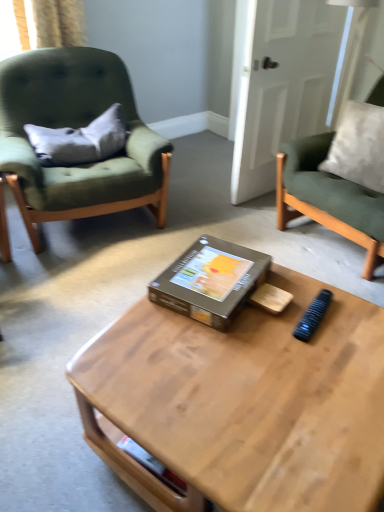
Question: Is gray fabric pillow at left smaller than green fabric chair at left, the second chair from the right?

Choices:
 (A) yes
 (B) no

Answer: (A)

Question: Would you say gray fabric pillow at left contains green fabric chair at left, arranged as the 1th chair when viewed from the left?

Choices:
 (A) no
 (B) yes

Answer: (A)

Question: From a real-world perspective, is gray fabric pillow at left located beneath green fabric chair at left, arranged as the 1th chair when viewed from the left?

Choices:
 (A) no
 (B) yes

Answer: (A)

Question: Is gray fabric pillow at left turned away from green fabric chair at left, arranged as the 1th chair when viewed from the left?

Choices:
 (A) no
 (B) yes

Answer: (B)

Question: Is gray fabric pillow at left closer to camera compared to green fabric chair at left, arranged as the 1th chair when viewed from the left?

Choices:
 (A) yes
 (B) no

Answer: (B)

Question: Does point (56, 158) appear closer or farther from the camera than point (218, 269)?

Choices:
 (A) closer
 (B) farther

Answer: (B)

Question: Do you think gray fabric pillow at left is within brown cardboard box at center, or outside of it?

Choices:
 (A) inside
 (B) outside

Answer: (B)

Question: Considering the positions of gray fabric pillow at left and brown cardboard box at center in the image, is gray fabric pillow at left wider or thinner than brown cardboard box at center?

Choices:
 (A) thin
 (B) wide

Answer: (A)

Question: In the image, is gray fabric pillow at left on the left side or the right side of brown cardboard box at center?

Choices:
 (A) right
 (B) left

Answer: (B)

Question: In terms of size, does gray fabric pillow at left appear bigger or smaller than black plastic remote control at center?

Choices:
 (A) big
 (B) small

Answer: (A)

Question: Relative to black plastic remote control at center, is gray fabric pillow at left in front or behind?

Choices:
 (A) front
 (B) behind

Answer: (B)

Question: From a real-world perspective, relative to black plastic remote control at center, is gray fabric pillow at left vertically above or below?

Choices:
 (A) above
 (B) below

Answer: (A)

Question: In terms of width, does gray fabric pillow at left look wider or thinner when compared to black plastic remote control at center?

Choices:
 (A) thin
 (B) wide

Answer: (A)

Question: Considering the positions of green fabric chair at left, the second chair from the right, and gray fabric pillow at left in the image, is green fabric chair at left, the second chair from the right, bigger or smaller than gray fabric pillow at left?

Choices:
 (A) small
 (B) big

Answer: (B)

Question: From the image's perspective, relative to gray fabric pillow at left, is green fabric chair at left, the second chair from the right, above or below?

Choices:
 (A) below
 (B) above

Answer: (A)